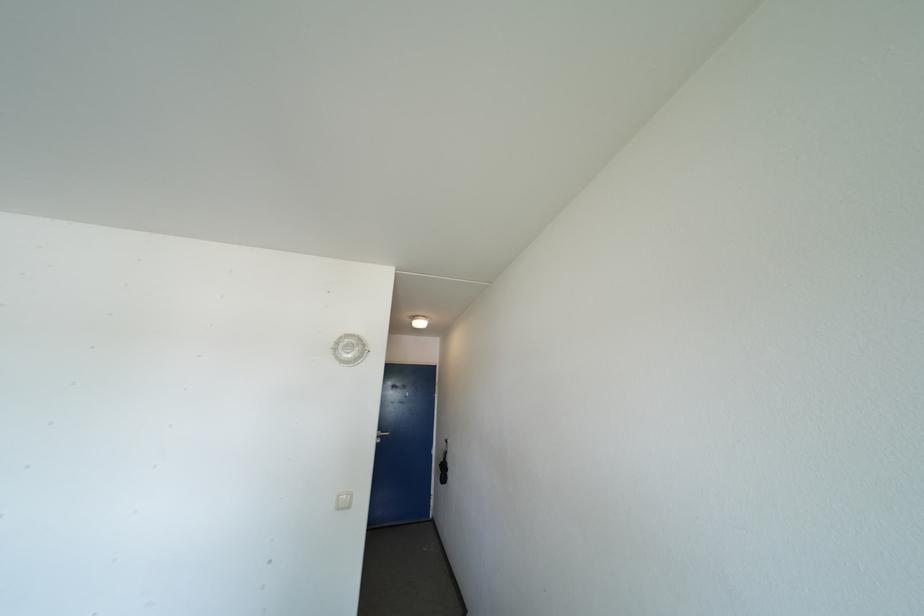
At what (x,y) coordinates should I click in order to perform the action: click on silver door handle. Please return your answer as a coordinate pair (x, y). The image size is (924, 616). Looking at the image, I should click on (381, 435).